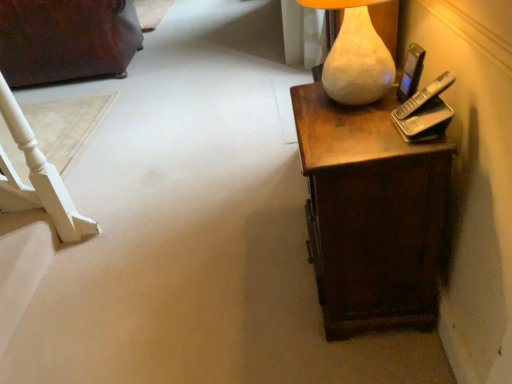
Find the location of a particular element. The height and width of the screenshot is (384, 512). vacant position to the left of brown wood desk at right is located at coordinates (252, 294).